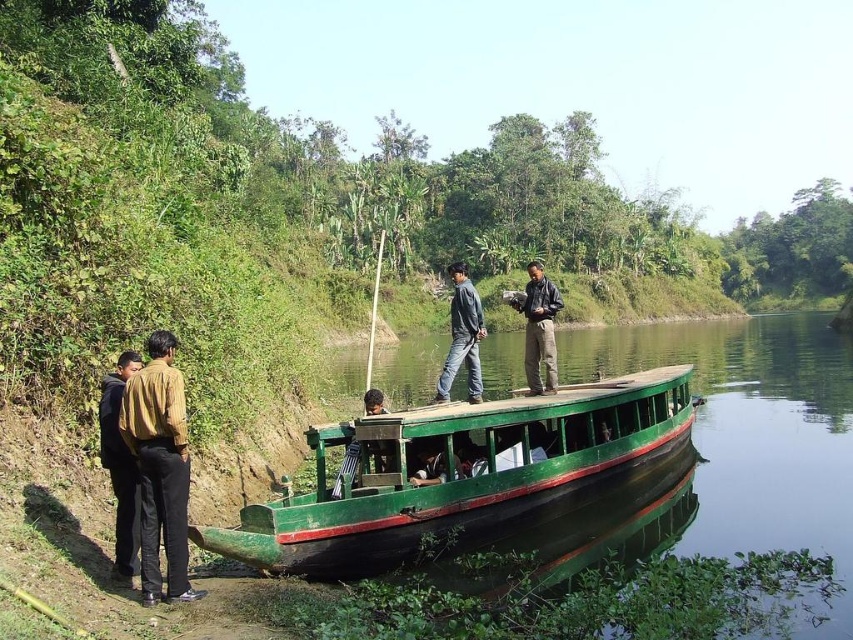
Question: Which point is farther from the camera taking this photo?

Choices:
 (A) [547, 374]
 (B) [553, 406]
 (C) [451, 333]

Answer: (C)

Question: Is dark blue jeans at center bigger than leather jacket at center?

Choices:
 (A) no
 (B) yes

Answer: (A)

Question: Which point is farther to the camera?

Choices:
 (A) (524, 337)
 (B) (135, 531)

Answer: (A)

Question: Among these points, which one is nearest to the camera?

Choices:
 (A) (102, 445)
 (B) (679, 381)
 (C) (485, 333)

Answer: (A)

Question: Is brown cotton shirt at left below leather jacket at center?

Choices:
 (A) yes
 (B) no

Answer: (A)

Question: Can you confirm if green matte boat at center is positioned below dark brown leather jacket at lower left?

Choices:
 (A) no
 (B) yes

Answer: (B)